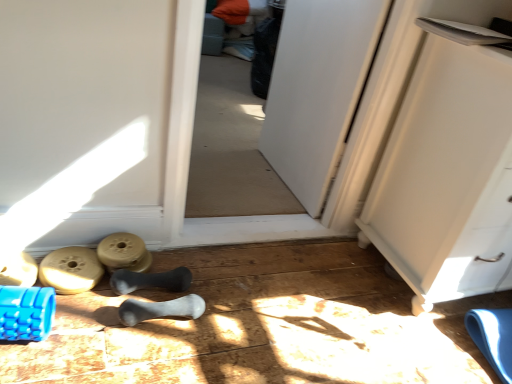
At what (x,y) coordinates should I click in order to perform the action: click on free point above matte rubber dumbbell at lower left, the 2th footwear when ordered from left to right (from a real-world perspective). Please return your answer as a coordinate pair (x, y). Looking at the image, I should click on pos(73,267).